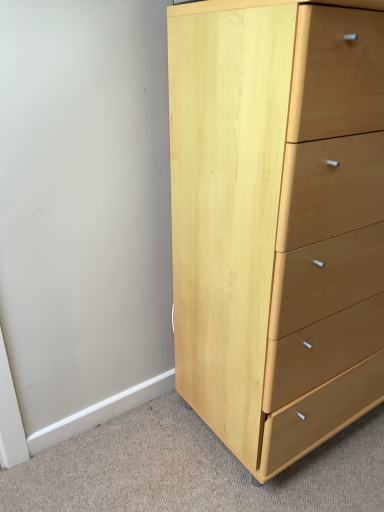
Question: Should I look upward or downward to see natural wood chest of drawers at right?

Choices:
 (A) up
 (B) down

Answer: (A)